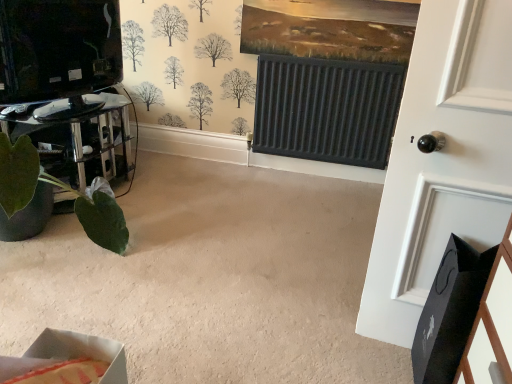
Question: From the image's perspective, is green matte plant pot at lower left above or below cardboard box at lower left?

Choices:
 (A) below
 (B) above

Answer: (B)

Question: From a real-world perspective, is green matte plant pot at lower left positioned above or below cardboard box at lower left?

Choices:
 (A) above
 (B) below

Answer: (B)

Question: Considering the real-world distances, which object is farthest from the cardboard box at lower left?

Choices:
 (A) white matte door at right
 (B) green matte plant pot at lower left

Answer: (B)

Question: Based on their relative distances, which object is farther from the cardboard box at lower left?

Choices:
 (A) green matte plant pot at lower left
 (B) white matte door at right

Answer: (A)